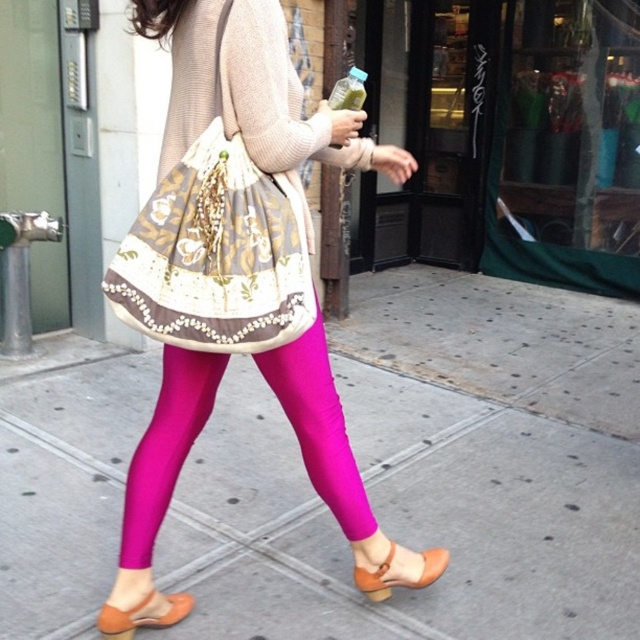
Question: Is matte pink leggings at center in front of matte magenta leggings at center?

Choices:
 (A) yes
 (B) no

Answer: (A)

Question: Is embroidered fabric bag at center bigger than matte brown sandal at lower center?

Choices:
 (A) yes
 (B) no

Answer: (A)

Question: Does matte pink leggings at center come behind matte orange sandal at lower center?

Choices:
 (A) yes
 (B) no

Answer: (B)

Question: Based on their relative distances, which object is farther from the matte orange sandal at lower center?

Choices:
 (A) pink fabric leggings at center
 (B) embroidered fabric bag at center
 (C) matte magenta leggings at center
 (D) matte pink leggings at center

Answer: (A)

Question: Which of the following is the closest to the observer?

Choices:
 (A) (122, 616)
 (B) (136, 484)
 (C) (259, 273)
 (D) (502, 624)

Answer: (C)

Question: Which object is closer to the camera taking this photo?

Choices:
 (A) pink fabric leggings at center
 (B) matte orange sandal at lower center

Answer: (B)